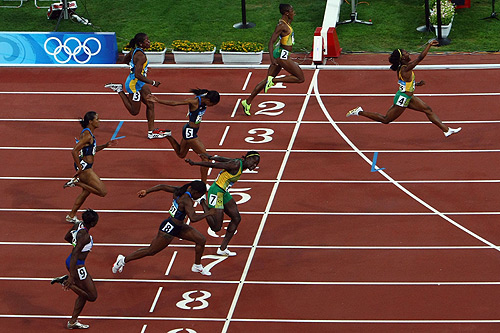
The height and width of the screenshot is (333, 500). Find the location of `planters`. planters is located at coordinates (156, 58), (189, 58), (227, 58), (444, 29).